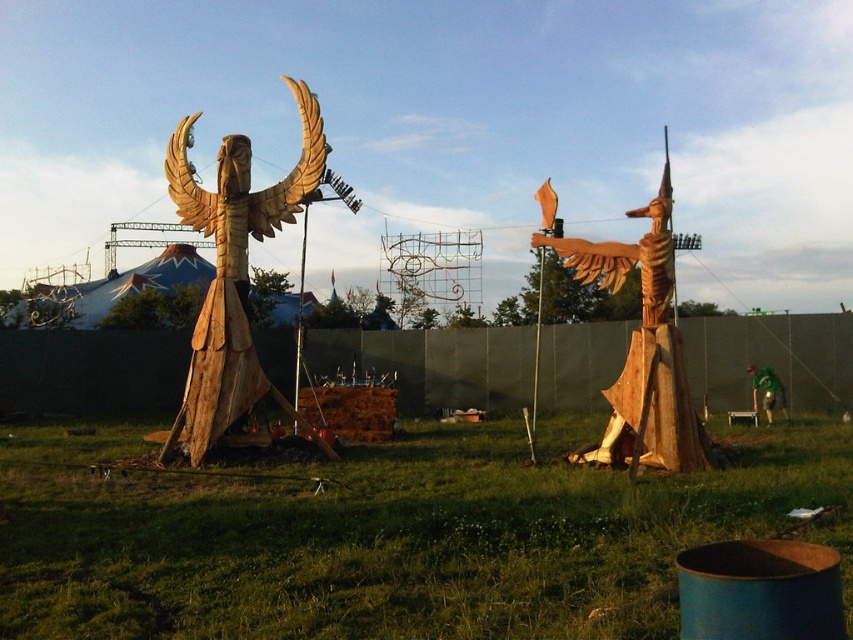
Question: Observing the image, what is the correct spatial positioning of green grass at center in reference to wooden statue at left?

Choices:
 (A) above
 (B) below

Answer: (B)

Question: Which of these objects is positioned closest to the green grass at center?

Choices:
 (A) wooden bird at center
 (B) wooden statue at left

Answer: (B)

Question: Among these objects, which one is nearest to the camera?

Choices:
 (A) wooden bird at center
 (B) wooden statue at left

Answer: (A)

Question: Can you confirm if green grass at center is thinner than wooden bird at center?

Choices:
 (A) yes
 (B) no

Answer: (A)

Question: Is green grass at center closer to camera compared to wooden bird at center?

Choices:
 (A) no
 (B) yes

Answer: (B)

Question: Considering the real-world distances, which object is farthest from the wooden bird at center?

Choices:
 (A) wooden statue at left
 (B) green grass at center

Answer: (A)